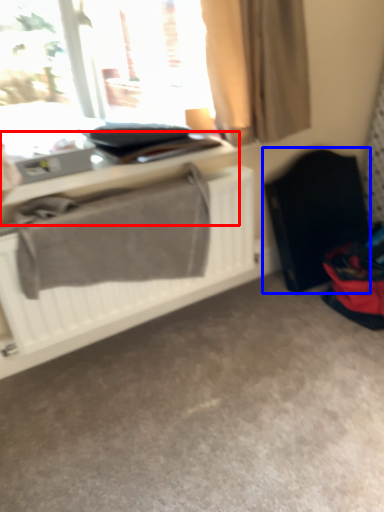
Question: Which of the following is the closest to the observer, table (highlighted by a red box) or folding chair (highlighted by a blue box)?

Choices:
 (A) table
 (B) folding chair

Answer: (A)